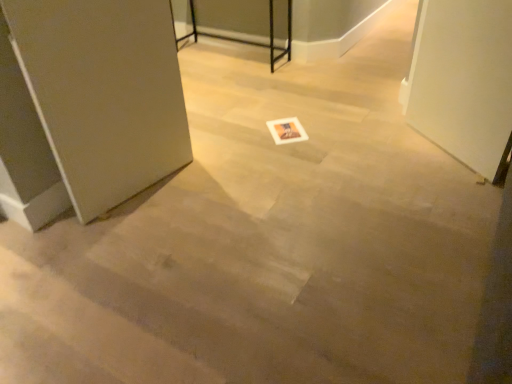
The height and width of the screenshot is (384, 512). Find the location of `free region under satin silver door at left (from a real-world perspective)`. free region under satin silver door at left (from a real-world perspective) is located at coordinates (136, 192).